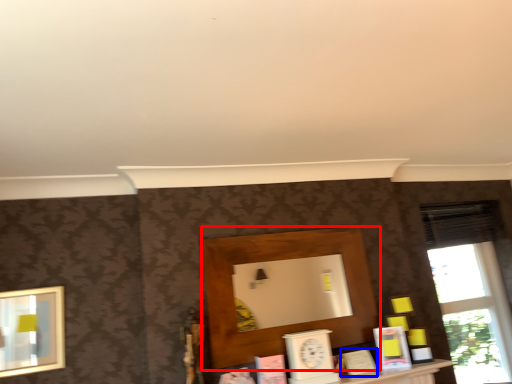
Question: Which object appears closest to the camera in this image, shelf (highlighted by a red box) or book (highlighted by a blue box)?

Choices:
 (A) shelf
 (B) book

Answer: (A)